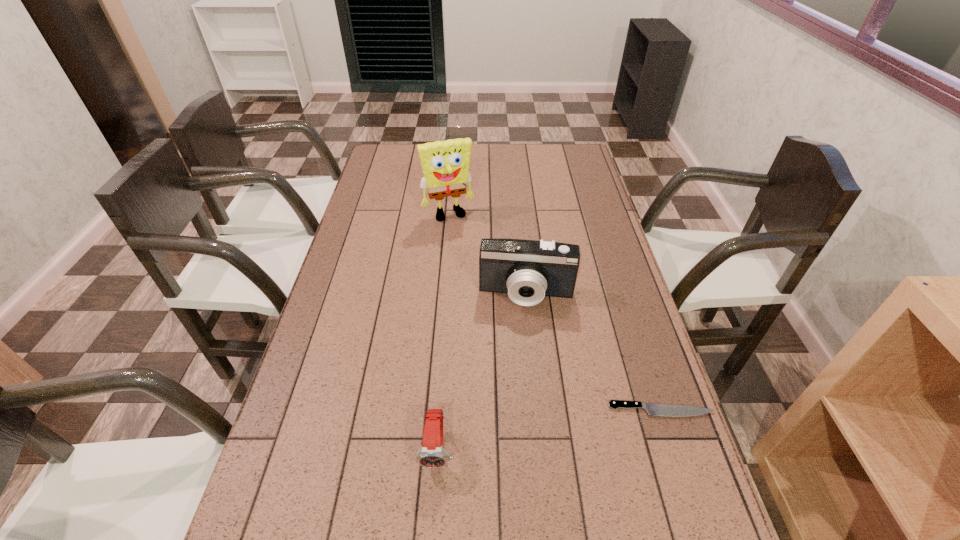
Identify the location of free space located 0.170m on the lens of the second object from right to left. (520, 360).

You are a GUI agent. You are given a task and a screenshot of the screen. Output one action in this format:
    pyautogui.click(x=<x>, y=<y>)
    Task: Click on the free space located on the lens of the second object from right to left
    
    Given the screenshot: What is the action you would take?
    pyautogui.click(x=522, y=328)

Image resolution: width=960 pixels, height=540 pixels. What are the coordinates of `free space located 0.370m on the lens of the second object from right to left` in the screenshot? It's located at (516, 432).

This screenshot has width=960, height=540. Find the location of `blank space located 0.400m on the face of the tallest object`. blank space located 0.400m on the face of the tallest object is located at coordinates (489, 303).

Where is `vacant space located 0.060m on the face of the tallest object`? vacant space located 0.060m on the face of the tallest object is located at coordinates (460, 234).

Locate an element on the screen. This screenshot has height=540, width=960. free space located on the face of the tallest object is located at coordinates (472, 264).

I want to click on object positioned at the right edge, so click(x=652, y=409).

Where is `vacant space at the far edge of the desktop`? The image size is (960, 540). vacant space at the far edge of the desktop is located at coordinates pyautogui.click(x=487, y=156).

At what (x,y) coordinates should I click in order to perform the action: click on free space at the left edge of the desktop. Please return your answer as a coordinate pair (x, y). Looking at the image, I should click on (377, 205).

The image size is (960, 540). I want to click on vacant space at the right edge of the desktop, so click(x=592, y=194).